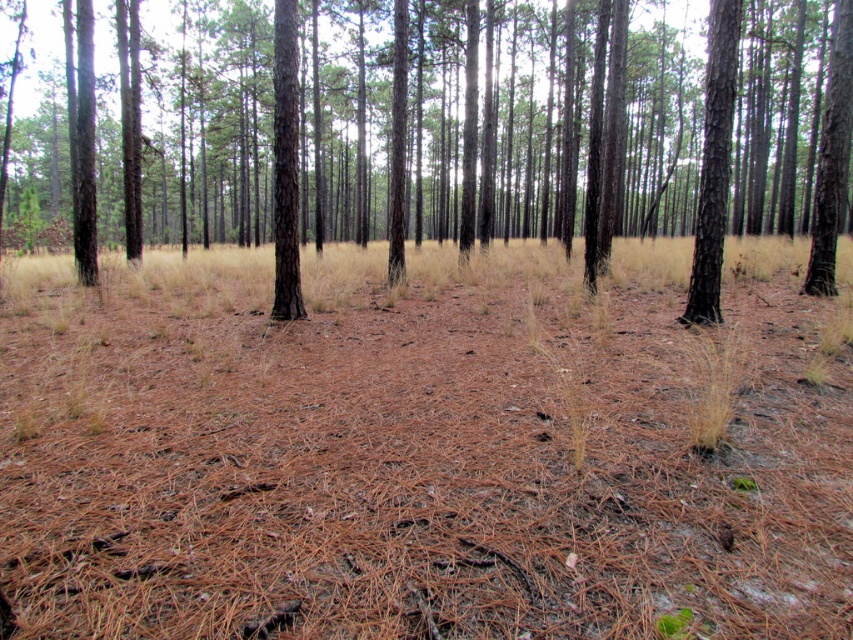
Question: From the image, what is the correct spatial relationship of smooth brown tree trunk at right in relation to smooth brown tree at center?

Choices:
 (A) below
 (B) above

Answer: (A)

Question: Does brown dry grass at center have a larger size compared to smooth brown tree at center?

Choices:
 (A) no
 (B) yes

Answer: (B)

Question: Does brown smooth tree at center appear under smooth brown tree at center?

Choices:
 (A) yes
 (B) no

Answer: (B)

Question: Which point appears closest to the camera in this image?

Choices:
 (A) (838, 234)
 (B) (567, 298)
 (C) (282, 64)

Answer: (C)

Question: Which point is closer to the camera taking this photo?

Choices:
 (A) (96, 429)
 (B) (706, 224)
 (C) (292, 228)

Answer: (A)

Question: Considering the real-world distances, which object is farthest from the brown dry grass at center?

Choices:
 (A) smooth brown tree at center
 (B) brown smooth tree at center

Answer: (B)